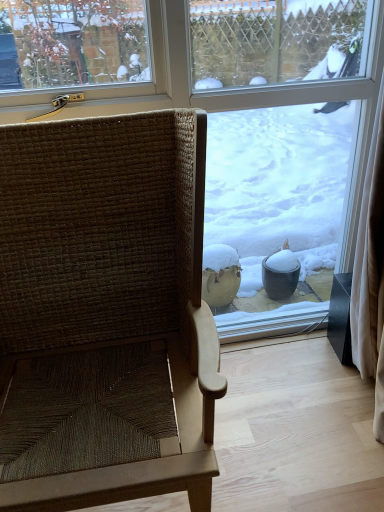
Image resolution: width=384 pixels, height=512 pixels. What do you see at coordinates (105, 313) in the screenshot?
I see `woven brown chair at left` at bounding box center [105, 313].

At what (x,y) coordinates should I click in order to perform the action: click on woven brown chair at left. Please return your answer as a coordinate pair (x, y). This screenshot has height=512, width=384. Looking at the image, I should click on (105, 313).

The height and width of the screenshot is (512, 384). What do you see at coordinates (213, 92) in the screenshot? I see `transparent glass window at center` at bounding box center [213, 92].

Identify the location of transparent glass window at center. This screenshot has width=384, height=512. (213, 92).

Image resolution: width=384 pixels, height=512 pixels. Find the location of `woven brown chair at left`. woven brown chair at left is located at coordinates (105, 313).

Which is more to the right, transparent glass window at center or woven brown chair at left?

Positioned to the right is transparent glass window at center.

In the scene shown: Does transparent glass window at center lie in front of woven brown chair at left?

No.

Considering the positions of points (81, 108) and (170, 462), is point (81, 108) closer to camera compared to point (170, 462)?

No, it is not.

From the image's perspective, does transparent glass window at center appear lower than woven brown chair at left?

No.

From a real-world perspective, is transparent glass window at center positioned above or below woven brown chair at left?

From a real-world perspective, transparent glass window at center is physically above woven brown chair at left.

Is transparent glass window at center thinner than woven brown chair at left?

Yes.

Between transparent glass window at center and woven brown chair at left, which one has less height?

woven brown chair at left is shorter.

Is transparent glass window at center bigger than woven brown chair at left?

Actually, transparent glass window at center might be smaller than woven brown chair at left.

Would you say woven brown chair at left is part of transparent glass window at center's contents?

No, woven brown chair at left is not inside transparent glass window at center.

Consider the image. Is there a large distance between transparent glass window at center and woven brown chair at left?

No, transparent glass window at center is not far from woven brown chair at left.

From the picture: Could you tell me if transparent glass window at center is turned towards woven brown chair at left?

Yes, transparent glass window at center is oriented towards woven brown chair at left.

This screenshot has height=512, width=384. In the image, there is a transparent glass window at center. Find the location of `chair below it (from the image's perspective)`. chair below it (from the image's perspective) is located at coordinates (105, 313).

Considering the positions of objects woven brown chair at left and transparent glass window at center in the image provided, who is more to the left, woven brown chair at left or transparent glass window at center?

From the viewer's perspective, woven brown chair at left appears more on the left side.

Considering the relative positions of woven brown chair at left and transparent glass window at center in the image provided, is woven brown chair at left behind transparent glass window at center?

No.

Does point (150, 175) appear closer or farther from the camera than point (71, 109)?

Point (150, 175) is closer to the camera than point (71, 109).

From the image's perspective, is woven brown chair at left beneath transparent glass window at center?

Indeed, from the image's perspective, woven brown chair at left is shown beneath transparent glass window at center.

From the picture: From a real-world perspective, is woven brown chair at left physically above transparent glass window at center?

No.

Is woven brown chair at left thinner than transparent glass window at center?

No.

Considering the sizes of objects woven brown chair at left and transparent glass window at center in the image provided, who is taller, woven brown chair at left or transparent glass window at center?

transparent glass window at center.

Who is smaller, woven brown chair at left or transparent glass window at center?

Smaller between the two is transparent glass window at center.

Is woven brown chair at left completely or partially outside of transparent glass window at center?

Yes, woven brown chair at left is located beyond the bounds of transparent glass window at center.

Is woven brown chair at left in contact with transparent glass window at center?

→ woven brown chair at left and transparent glass window at center are clearly separated.

Does woven brown chair at left turn towards transparent glass window at center?

No, woven brown chair at left is not aimed at transparent glass window at center.

Where is `chair that is below the transparent glass window at center (from the image's perspective)`? The image size is (384, 512). chair that is below the transparent glass window at center (from the image's perspective) is located at coordinates (105, 313).

This screenshot has height=512, width=384. I want to click on chair below the transparent glass window at center (from the image's perspective), so click(x=105, y=313).

This screenshot has height=512, width=384. I want to click on window above the woven brown chair at left (from a real-world perspective), so click(213, 92).